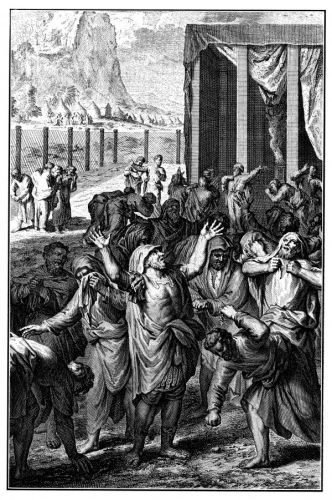
The height and width of the screenshot is (500, 332). In order to click on pillar in this screenshot , I will do `click(242, 103)`.